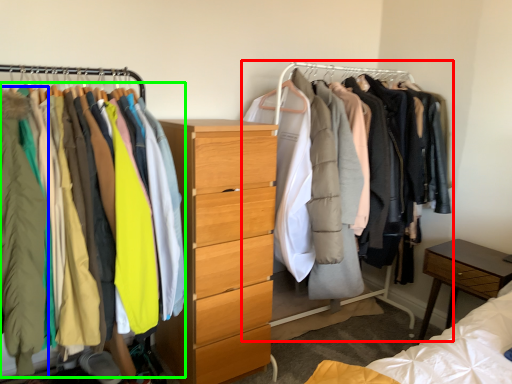
Question: Estimate the real-world distances between objects in this image. Which object is farther from closet (highlighted by a red box), clothing (highlighted by a blue box) or clothing (highlighted by a green box)?

Choices:
 (A) clothing
 (B) clothing

Answer: (A)